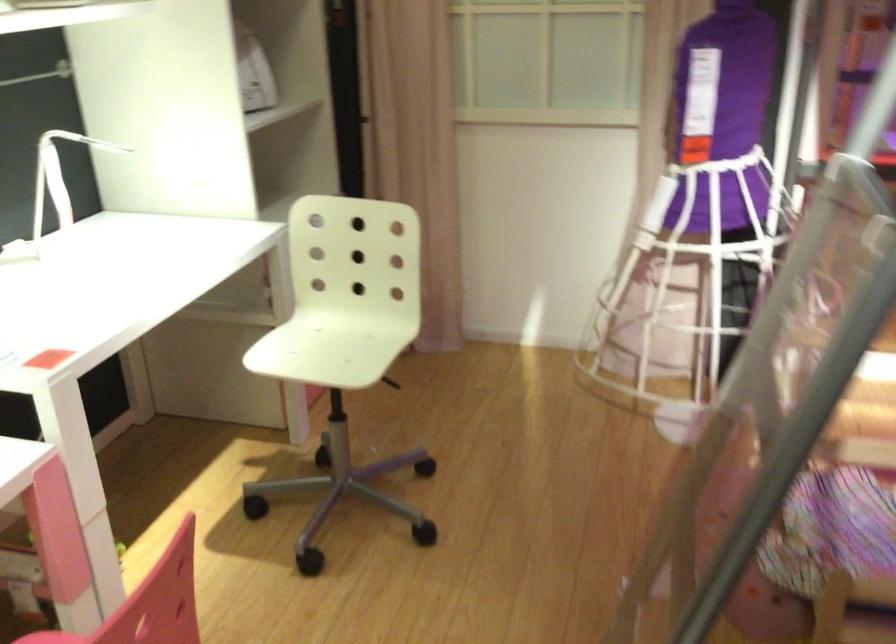
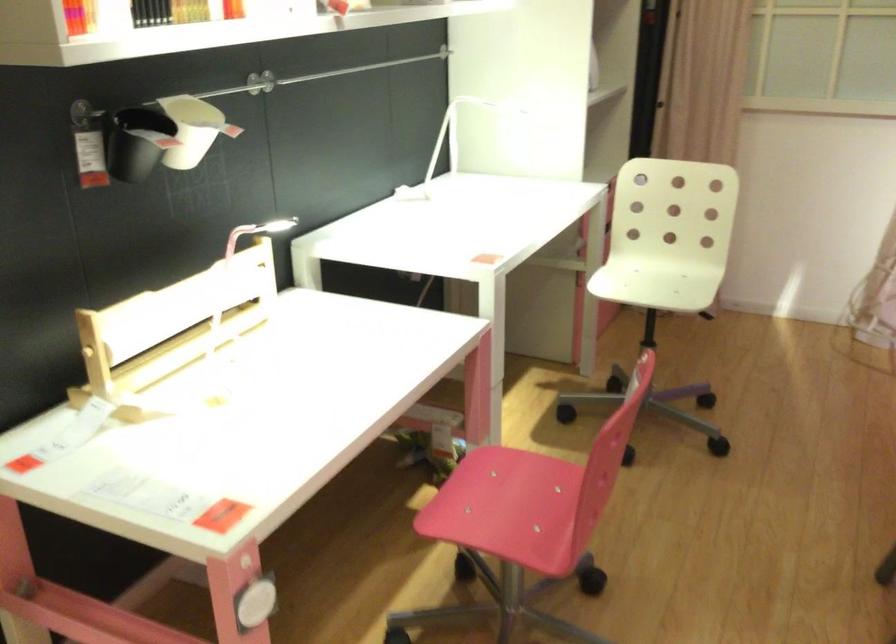
Question: The camera is either moving clockwise (left) or counter-clockwise (right) around the object. The first image is from the beginning of the video and the second image is from the end. Is the camera moving left or right when shooting the video?

Choices:
 (A) Left
 (B) Right

Answer: (B)